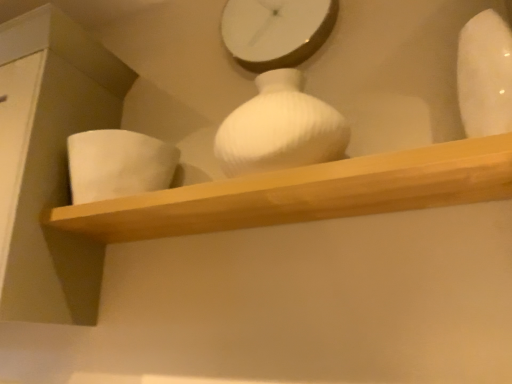
Question: Can you confirm if wooden shelf at center is taller than white matte vase at left, positioned as the 2th vase in right-to-left order?

Choices:
 (A) yes
 (B) no

Answer: (B)

Question: Does wooden shelf at center have a larger size compared to white matte vase at left, acting as the 1th vase starting from the back?

Choices:
 (A) no
 (B) yes

Answer: (B)

Question: Is wooden shelf at center not close to white matte vase at left, positioned as the 2th vase in right-to-left order?

Choices:
 (A) no
 (B) yes

Answer: (A)

Question: Considering the relative sizes of wooden shelf at center and white matte vase at left, positioned as the 2th vase in right-to-left order, in the image provided, is wooden shelf at center smaller than white matte vase at left, positioned as the 2th vase in right-to-left order,?

Choices:
 (A) no
 (B) yes

Answer: (A)

Question: From a real-world perspective, is wooden shelf at center over white matte vase at left, positioned as the 2th vase in right-to-left order?

Choices:
 (A) no
 (B) yes

Answer: (A)

Question: Is white matte vase at left, positioned as the 2th vase in right-to-left order, wider or thinner than white glossy clock at upper center?

Choices:
 (A) wide
 (B) thin

Answer: (A)

Question: From the image's perspective, relative to white glossy clock at upper center, is white matte vase at left, arranged as the 1th vase when viewed from the left, above or below?

Choices:
 (A) above
 (B) below

Answer: (B)

Question: Considering the positions of white matte vase at left, arranged as the 1th vase when viewed from the left, and white glossy clock at upper center in the image, is white matte vase at left, arranged as the 1th vase when viewed from the left, bigger or smaller than white glossy clock at upper center?

Choices:
 (A) big
 (B) small

Answer: (A)

Question: Considering their positions, is white matte vase at left, acting as the 1th vase starting from the back, located in front of or behind white glossy clock at upper center?

Choices:
 (A) front
 (B) behind

Answer: (A)

Question: Considering the positions of point (400, 175) and point (294, 14), is point (400, 175) closer or farther from the camera than point (294, 14)?

Choices:
 (A) farther
 (B) closer

Answer: (B)

Question: In terms of size, does wooden shelf at center appear bigger or smaller than white glossy clock at upper center?

Choices:
 (A) big
 (B) small

Answer: (A)

Question: Looking at their shapes, would you say wooden shelf at center is wider or thinner than white glossy clock at upper center?

Choices:
 (A) thin
 (B) wide

Answer: (B)

Question: From a real-world perspective, is wooden shelf at center positioned above or below white glossy clock at upper center?

Choices:
 (A) below
 (B) above

Answer: (A)

Question: Does point (234, 57) appear closer or farther from the camera than point (88, 155)?

Choices:
 (A) farther
 (B) closer

Answer: (A)

Question: Visually, is white glossy clock at upper center positioned to the left or to the right of white matte vase at left, positioned as the 2th vase in right-to-left order?

Choices:
 (A) left
 (B) right

Answer: (B)